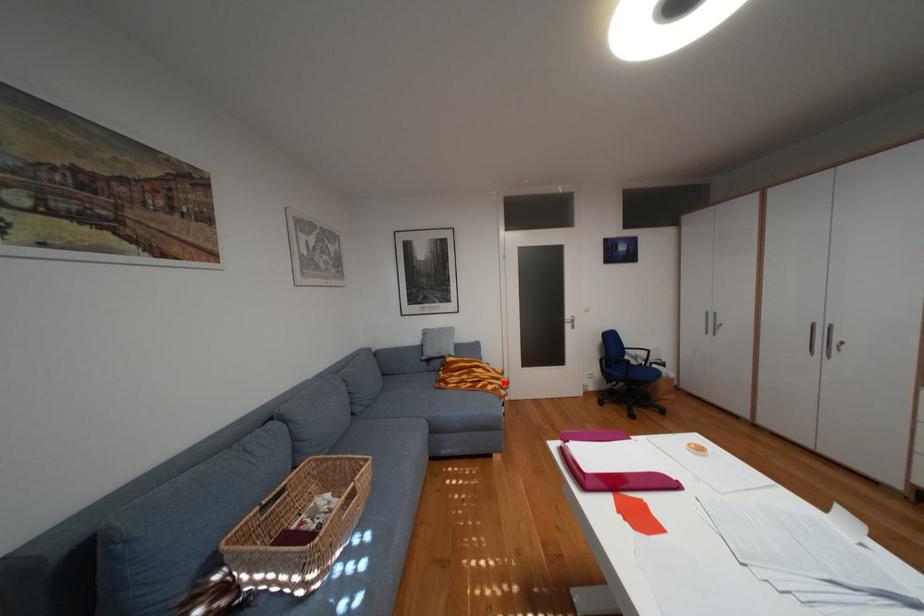
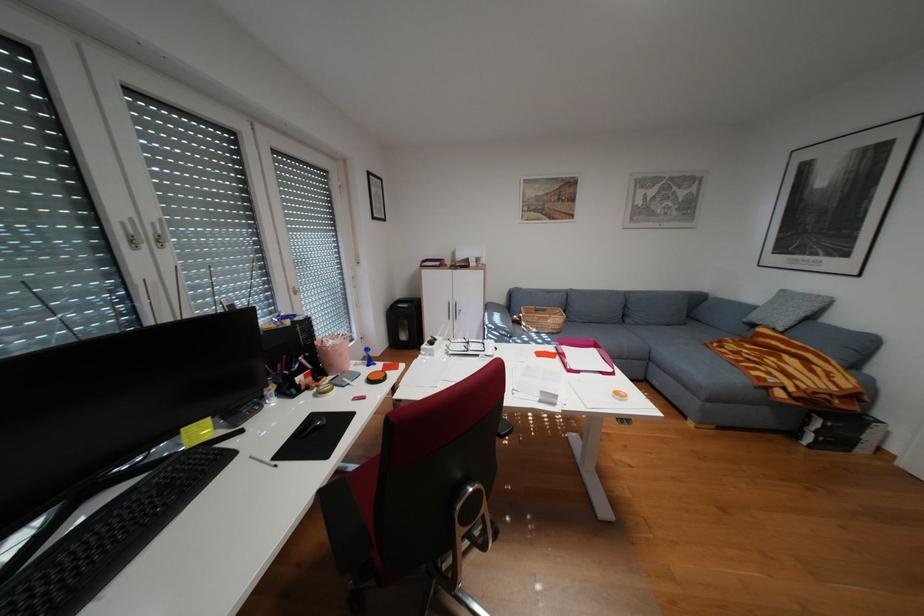
Where in the second image is the point corresponding to the highlighted location from the first image?

(782, 373)